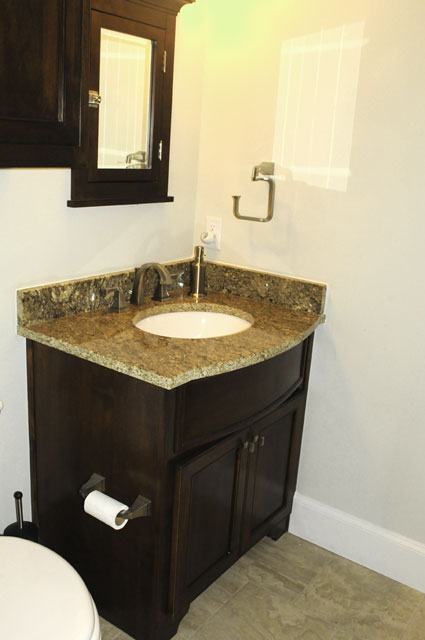
This screenshot has height=640, width=425. I want to click on mirror, so click(124, 95).